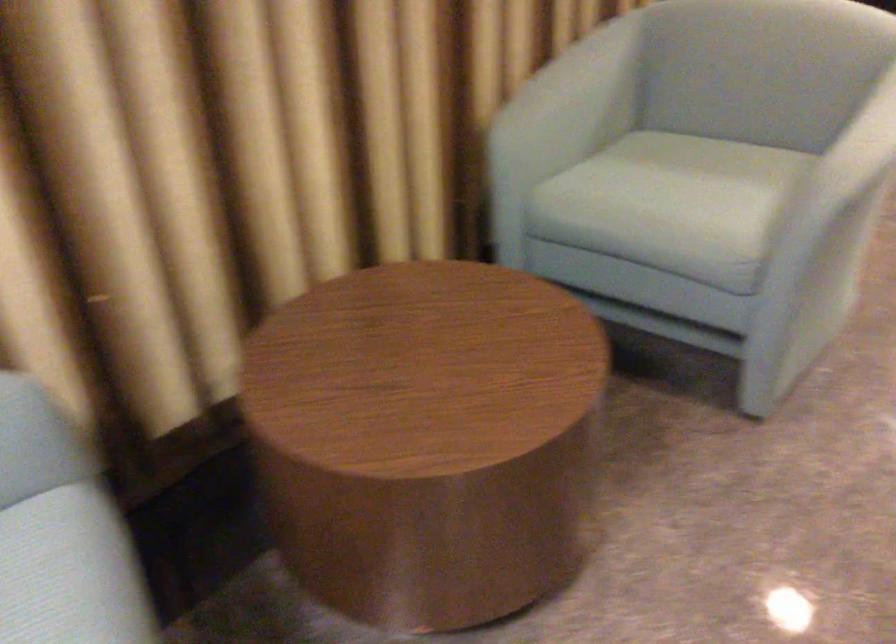
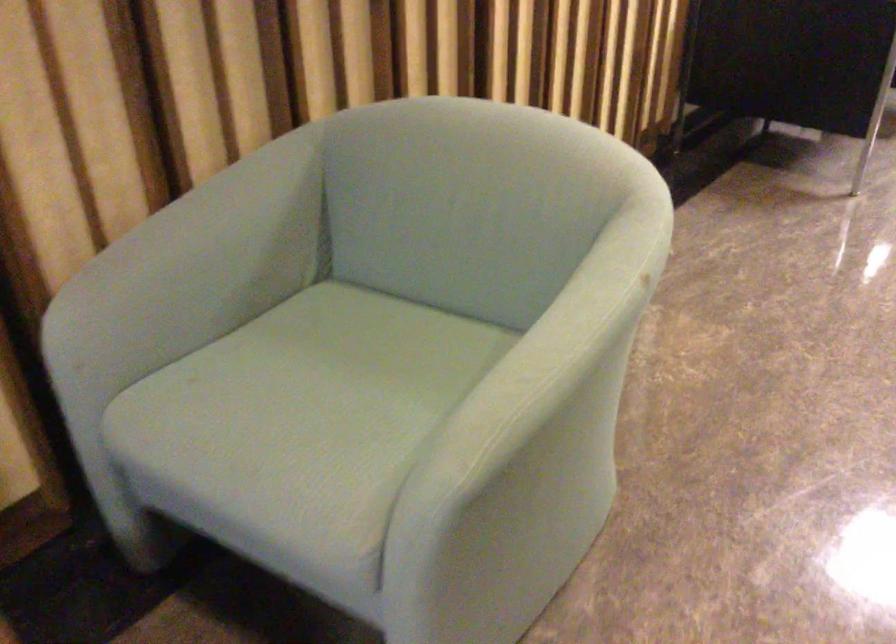
The point at (571, 106) is marked in the first image. Where is the corresponding point in the second image?

(192, 269)